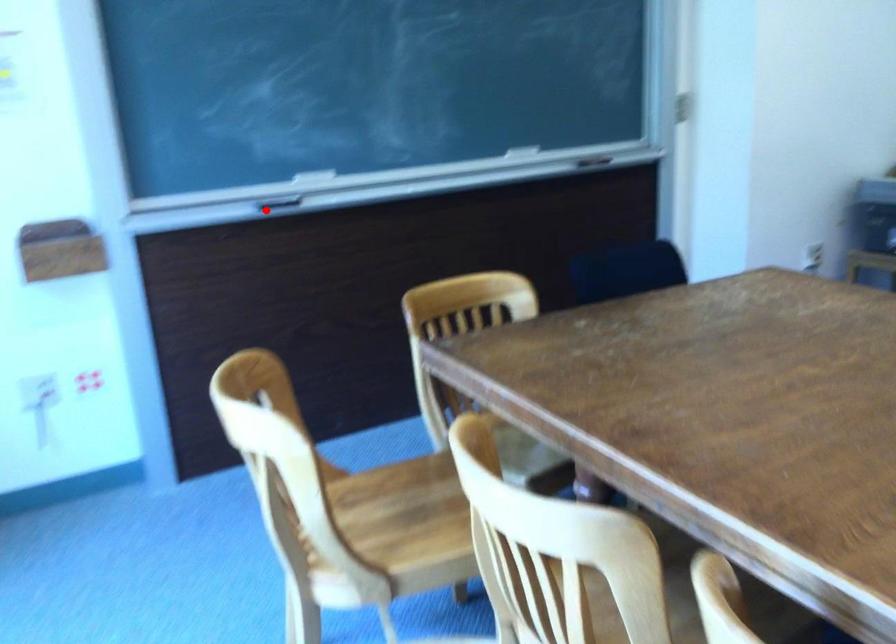
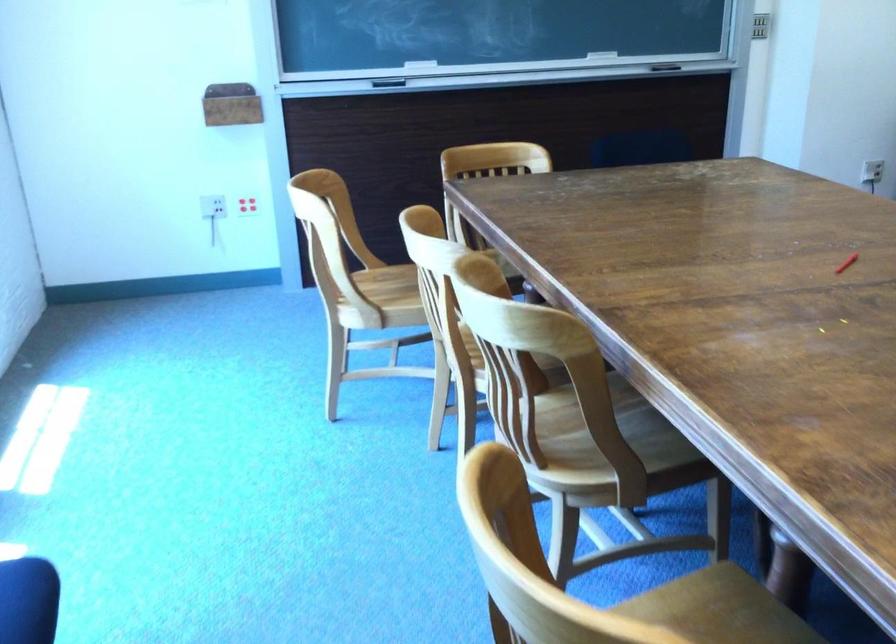
In the second image, find the point that corresponds to the highlighted location in the first image.

(389, 82)